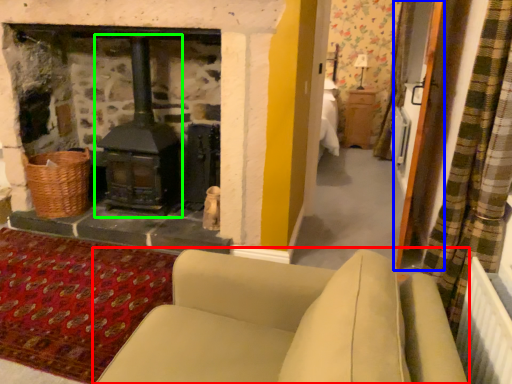
Question: Which object is the farthest from studio couch (highlighted by a red box)? Choose among these: screen door (highlighted by a blue box) or wood burning stove (highlighted by a green box).

Choices:
 (A) screen door
 (B) wood burning stove

Answer: (B)